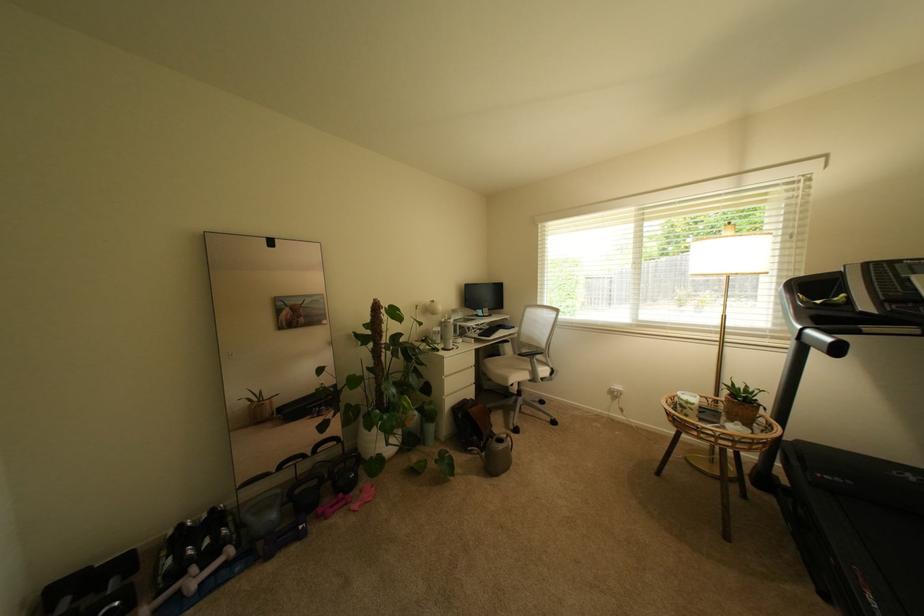
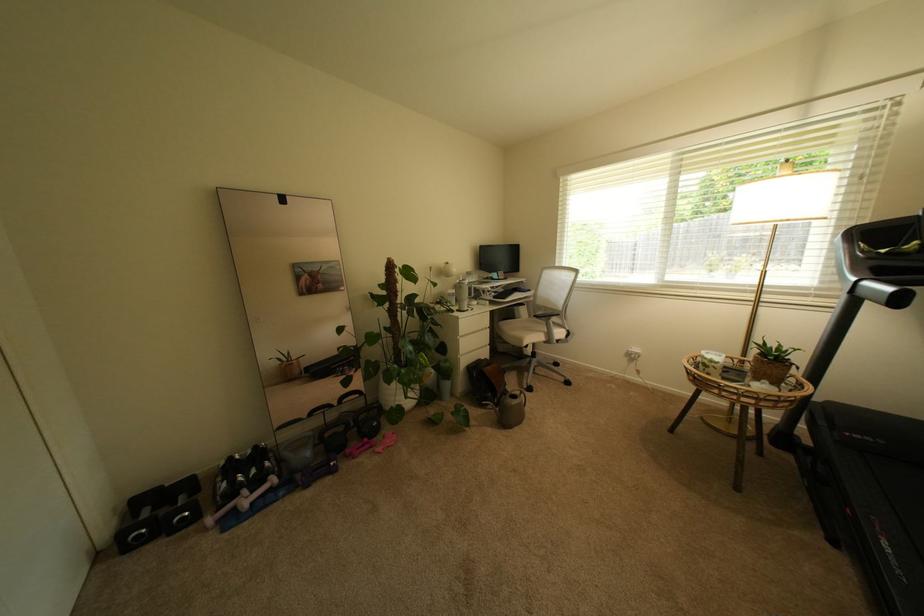
Question: The images are taken continuously from a first-person perspective. In which direction are you moving?

Choices:
 (A) Left
 (B) Right
 (C) Forward
 (D) Backward

Answer: (C)